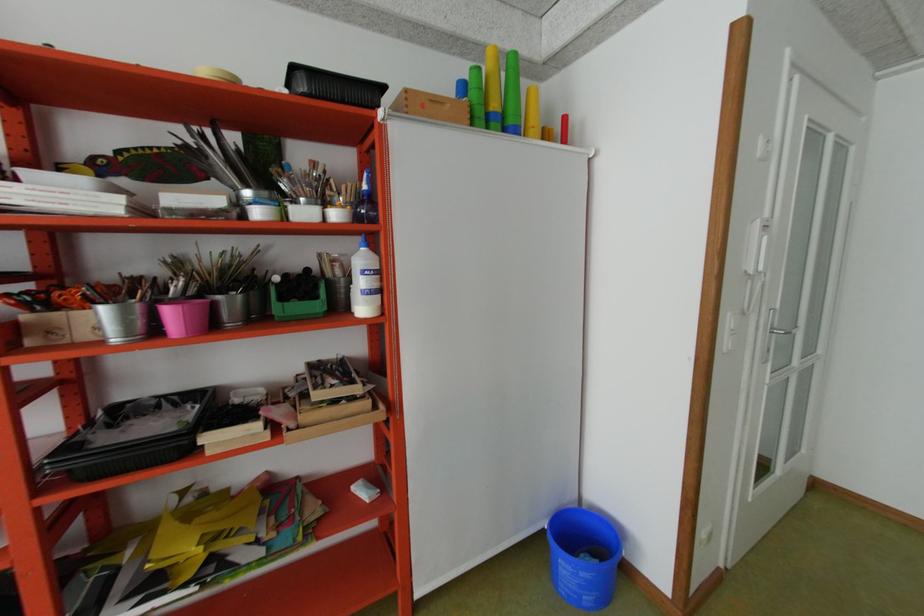
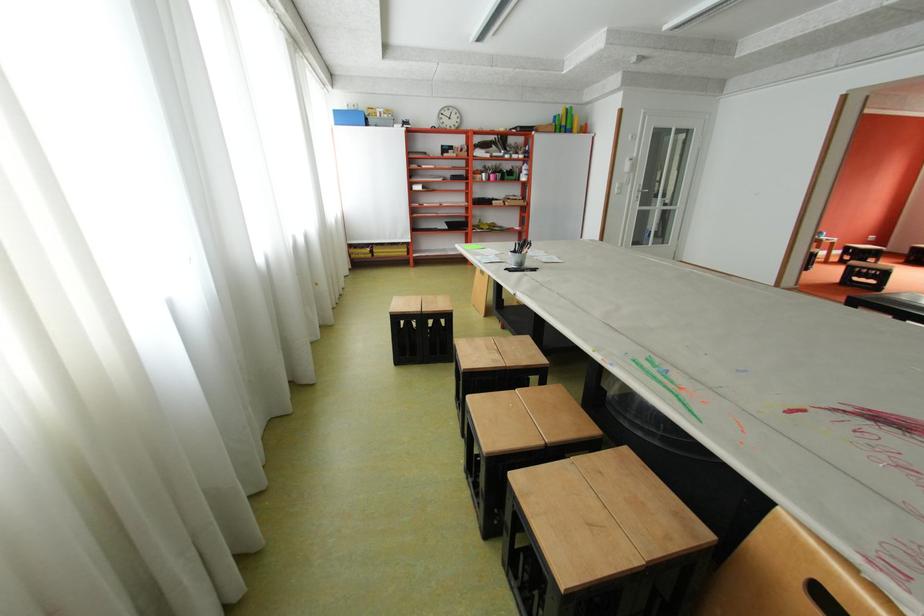
Question: The images are taken continuously from a first-person perspective. In which direction are you moving?

Choices:
 (A) Left
 (B) Right
 (C) Forward
 (D) Backward

Answer: (D)